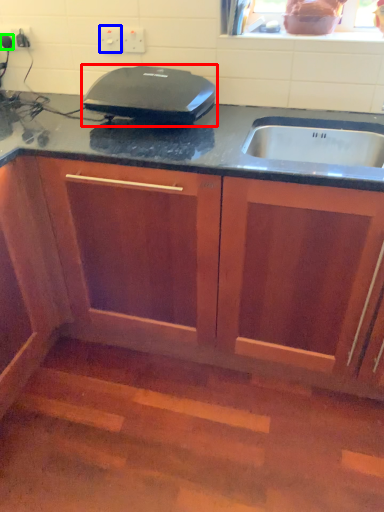
Question: Which object is positioned closest to home appliance (highlighted by a red box)? Select from electric outlet (highlighted by a blue box) and kitchen appliance (highlighted by a green box).

Choices:
 (A) electric outlet
 (B) kitchen appliance

Answer: (A)